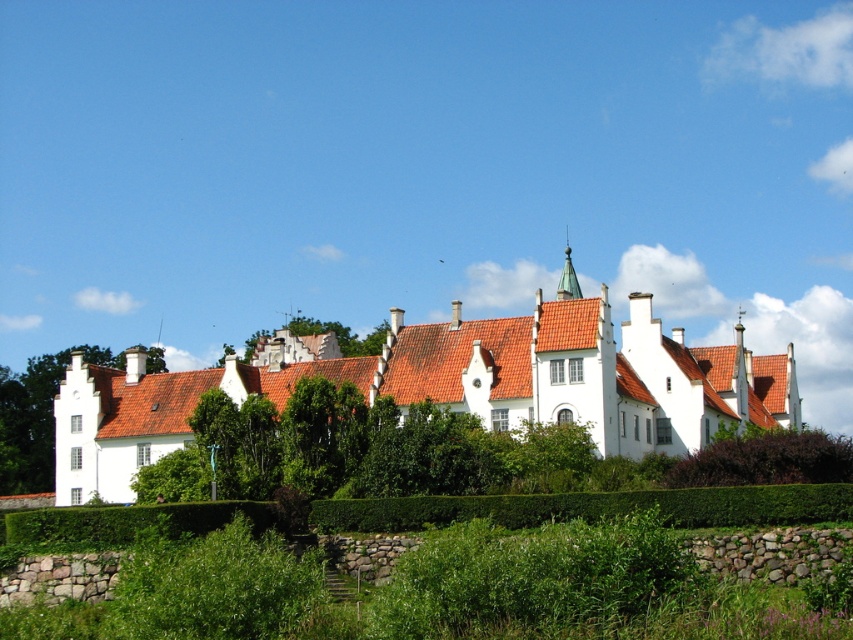
Question: Can you confirm if green leafy hedge at center is positioned to the right of green leafy tree at center?

Choices:
 (A) no
 (B) yes

Answer: (B)

Question: Which object appears farthest from the camera in this image?

Choices:
 (A) green leafy hedge at center
 (B) green leafy tree at left
 (C) green leafy tree at center
 (D) shiny copper spire at upper center

Answer: (C)

Question: Estimate the real-world distances between objects in this image. Which object is farther from the green leafy hedge at center?

Choices:
 (A) green leafy tree at center
 (B) shiny copper spire at upper center

Answer: (A)

Question: Among these points, which one is nearest to the camera?

Choices:
 (A) (364, 344)
 (B) (20, 426)
 (C) (776, 464)
 (D) (569, 248)

Answer: (C)

Question: Can you confirm if green leafy tree at left is smaller than green leafy hedge at center?

Choices:
 (A) yes
 (B) no

Answer: (A)

Question: Is green leafy tree at left to the right of green leafy tree at center from the viewer's perspective?

Choices:
 (A) yes
 (B) no

Answer: (B)